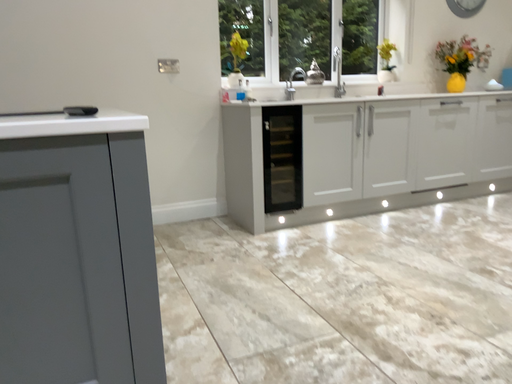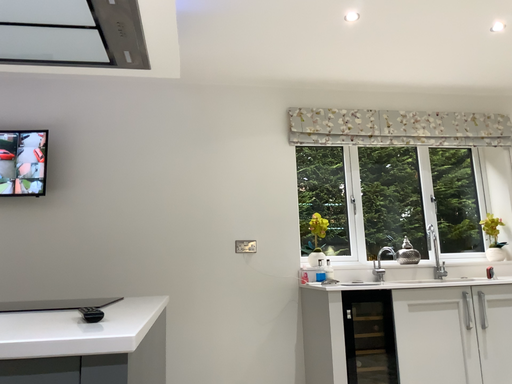
Question: How did the camera likely rotate when shooting the video?

Choices:
 (A) rotated right
 (B) rotated left

Answer: (B)